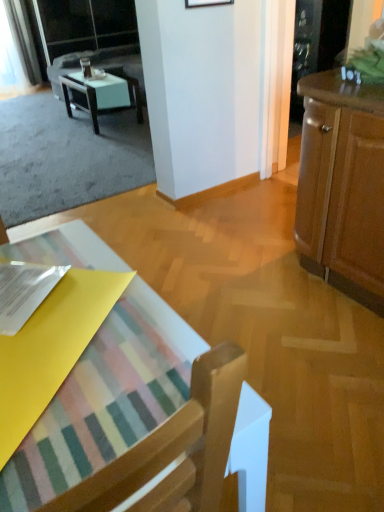
This screenshot has width=384, height=512. In order to click on blank space above wooden chair at lower left (from a real-world perspective) in this screenshot , I will do `click(77, 334)`.